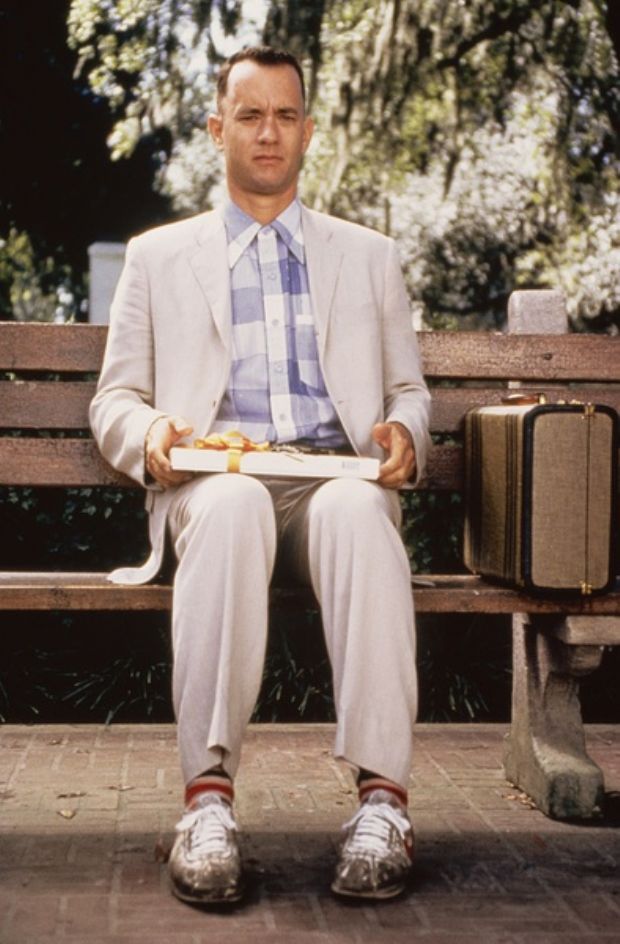
Locate an element on the screen. This screenshot has width=620, height=944. wood bench is located at coordinates (67, 334).